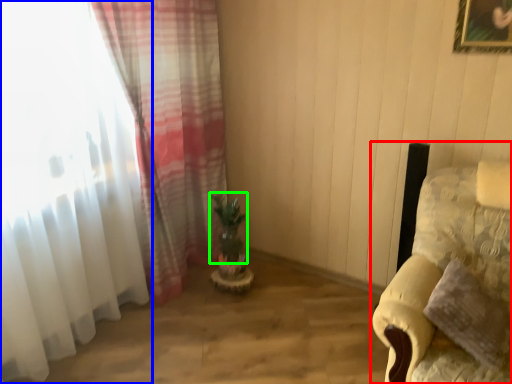
Question: Which object is the farthest from furniture (highlighted by a red box)? Choose among these: curtain (highlighted by a blue box) or plant (highlighted by a green box).

Choices:
 (A) curtain
 (B) plant

Answer: (A)